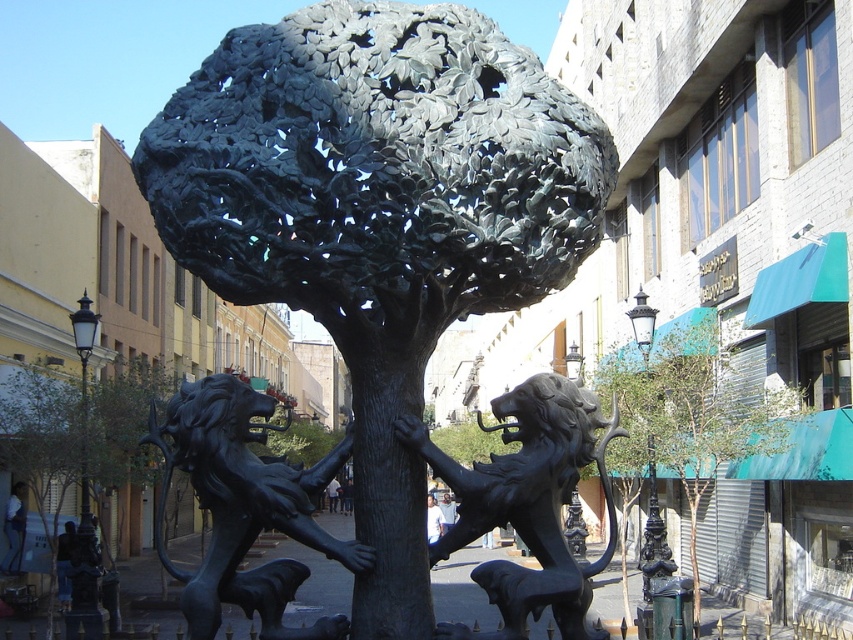
Question: Among these objects, which one is farthest from the camera?

Choices:
 (A) black polished stone lions at center
 (B) green matte tree at center

Answer: (B)

Question: Can you confirm if black polished stone lions at center is positioned to the right of green matte tree at center?

Choices:
 (A) no
 (B) yes

Answer: (A)

Question: Does bronze tree at center lie behind black polished stone lions at center?

Choices:
 (A) yes
 (B) no

Answer: (B)

Question: Which of the following is the closest to the observer?

Choices:
 (A) (567, 611)
 (B) (695, 500)
 (C) (28, 435)
 (D) (312, 518)

Answer: (A)

Question: Which object is positioned closest to the green matte tree at center?

Choices:
 (A) bronze tree at center
 (B) black polished stone lions at center

Answer: (B)

Question: Is bronze tree at center wider than bronze textured tree at center?

Choices:
 (A) no
 (B) yes

Answer: (A)